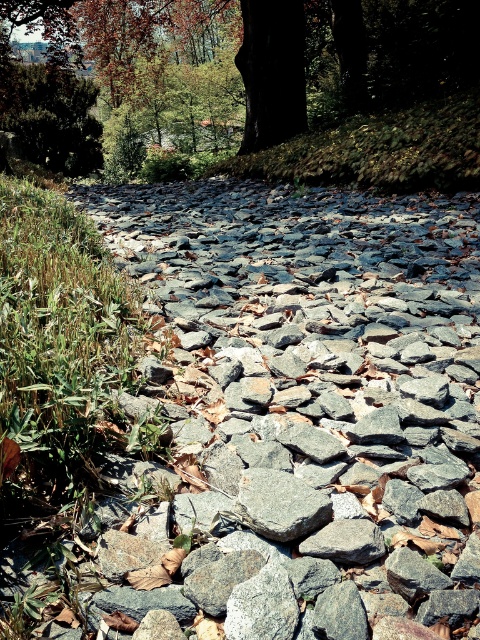
Question: Which object is the closest to the gray rough rocks at center?

Choices:
 (A) dark brown bark at upper center
 (B) gray rough stone at center

Answer: (B)

Question: Among these points, which one is nearest to the camera?

Choices:
 (A) (277, 493)
 (B) (273, 461)
 (C) (367, 156)

Answer: (A)

Question: Is gray rough rocks at center to the left of dark brown bark at upper center from the viewer's perspective?

Choices:
 (A) no
 (B) yes

Answer: (A)

Question: Is gray rough rocks at center smaller than gray rough stone at center?

Choices:
 (A) yes
 (B) no

Answer: (B)

Question: Among these objects, which one is nearest to the camera?

Choices:
 (A) gray rough stone at center
 (B) dark brown bark at upper center
 (C) gray rough rocks at center

Answer: (A)

Question: Where is gray rough rocks at center located in relation to gray rough stone at center in the image?

Choices:
 (A) right
 (B) left

Answer: (A)